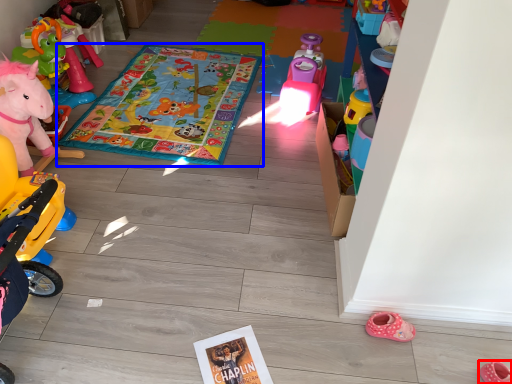
Question: Which point is closer to the camera, footwear (highlighted by a red box) or blanket (highlighted by a blue box)?

Choices:
 (A) footwear
 (B) blanket

Answer: (A)